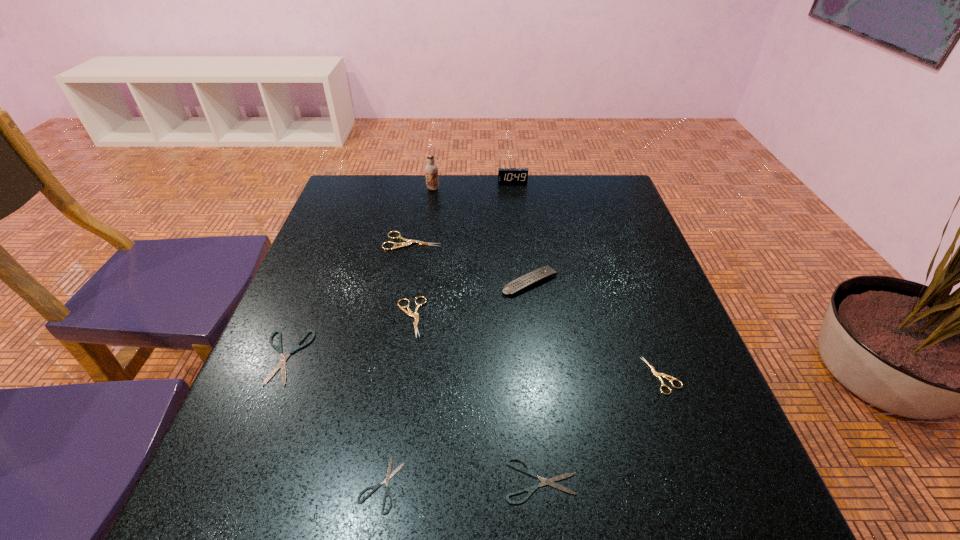
Find the location of a particular element. This screenshot has height=540, width=960. object located in the right edge section of the desktop is located at coordinates 657,374.

In the image, there is a desktop. Find the location of `vacant space at the far edge`. vacant space at the far edge is located at coordinates (421, 183).

Locate an element on the screen. This screenshot has width=960, height=540. blank area at the near edge is located at coordinates (503, 537).

Image resolution: width=960 pixels, height=540 pixels. What are the coordinates of `vacant point at the left edge` in the screenshot? It's located at (269, 410).

In the image, there is a desktop. At what (x,y) coordinates should I click in order to perform the action: click on vacant space at the right edge. Please return your answer as a coordinate pair (x, y). The height and width of the screenshot is (540, 960). Looking at the image, I should click on (663, 339).

At what (x,y) coordinates should I click in order to perform the action: click on vacant space at the far left corner. Please return your answer as a coordinate pair (x, y). This screenshot has height=540, width=960. Looking at the image, I should click on pos(349,183).

In the image, there is a desktop. Where is `vacant space at the far right corner`? The width and height of the screenshot is (960, 540). vacant space at the far right corner is located at coordinates (586, 193).

At what (x,y) coordinates should I click in order to perform the action: click on free space between the second tallest shears and the farthest shears. Please return your answer as a coordinate pair (x, y). Image resolution: width=960 pixels, height=540 pixels. Looking at the image, I should click on (411, 279).

Locate an element on the screen. The image size is (960, 540). free spot between the chocolate milk and the second farthest beige shears is located at coordinates (421, 253).

Where is `vacant space in between the tallest object and the third tallest object`? vacant space in between the tallest object and the third tallest object is located at coordinates (482, 235).